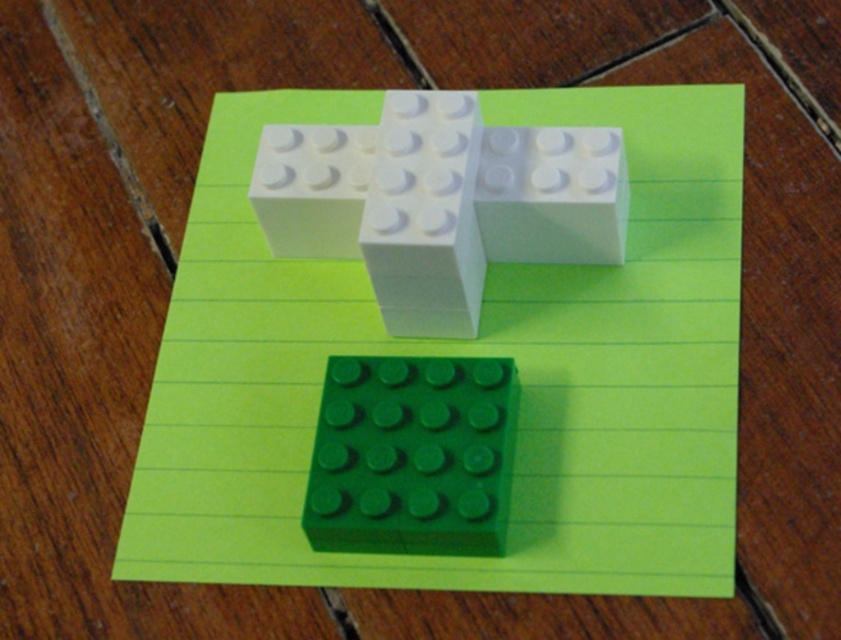
Is the position of white matte plastic blocks at upper center less distant than that of green matte block at center?

That is False.

Which is behind, point (257, 198) or point (321, 419)?

Point (257, 198)

Locate an element on the screen. white matte plastic blocks at upper center is located at coordinates (438, 202).

Who is lower down, green matte block at center or white plastic brick at upper center?

green matte block at center

Does green matte block at center lie in front of white plastic brick at upper center?

Yes, it is in front of white plastic brick at upper center.

Is point (424, 513) closer to viewer compared to point (580, 33)?

Yes, it is in front of point (580, 33).

Identify the location of green matte block at center. (411, 456).

Is green matte block at center taller than white matte block at center?

In fact, green matte block at center may be shorter than white matte block at center.

Image resolution: width=841 pixels, height=640 pixels. What are the coordinates of `green matte block at center` in the screenshot? It's located at (411, 456).